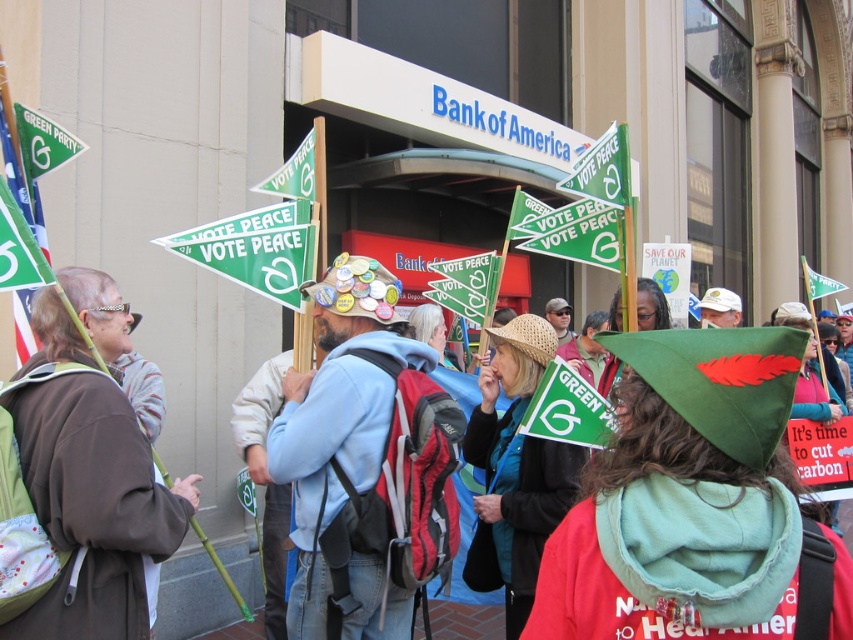
You are a photographer at the protest trying to capture a clear shot of both the brown fabric robe at left and the light blue fleece jacket at center. Since you can only focus on one subject at a time, which one should you choose to ensure the other remains in the background?

You should focus on the brown fabric robe at left because it is closer to the viewer than the light blue fleece jacket at center, so the jacket will naturally appear in the background if the robe is in focus.

You are part of the protest crowd and want to locate two specific items in the scene. The green felt hat at center and the light blue fleece jacket at center are both at the center of the image. Which one is positioned to the right of the other?

The green felt hat at center is to the right of the light blue fleece jacket at center.